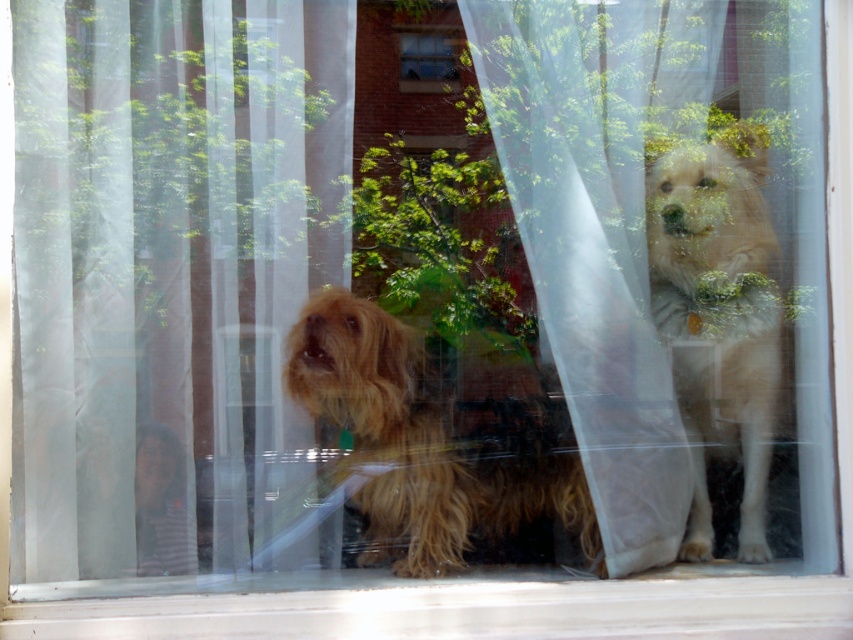
Can you confirm if fuzzy brown dog at center is positioned to the left of clear glass window at center?

No, fuzzy brown dog at center is not to the left of clear glass window at center.

Can you confirm if fuzzy brown dog at center is thinner than clear glass window at center?

In fact, fuzzy brown dog at center might be wider than clear glass window at center.

Image resolution: width=853 pixels, height=640 pixels. What do you see at coordinates (421, 445) in the screenshot?
I see `fuzzy brown dog at center` at bounding box center [421, 445].

This screenshot has height=640, width=853. Find the location of `fuzzy brown dog at center`. fuzzy brown dog at center is located at coordinates (421, 445).

Does point (264, 42) come farther from viewer compared to point (405, 48)?

No, it is not.

Does translucent white curtain at left have a larger size compared to clear glass window at center?

Indeed, translucent white curtain at left has a larger size compared to clear glass window at center.

Is point (306, 467) closer to viewer compared to point (415, 35)?

Yes, it is.

The image size is (853, 640). What are the coordinates of `translucent white curtain at left` in the screenshot? It's located at (172, 272).

Can you confirm if translucent white curtain at left is taller than fuzzy brown dog at center?

Yes, translucent white curtain at left is taller than fuzzy brown dog at center.

Which is in front, point (157, 392) or point (582, 484)?

Point (157, 392) is more forward.

The height and width of the screenshot is (640, 853). Find the location of `translucent white curtain at left`. translucent white curtain at left is located at coordinates (172, 272).